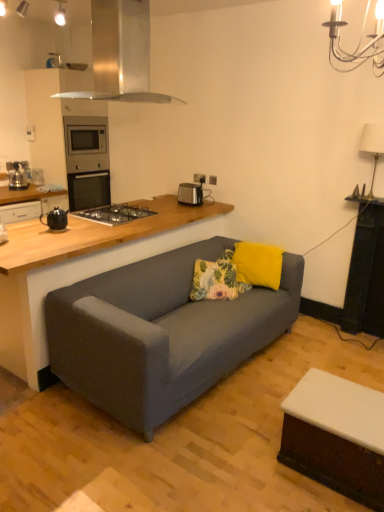
Where is `white glossy coffee table at lower right`? The height and width of the screenshot is (512, 384). white glossy coffee table at lower right is located at coordinates (336, 436).

You are a GUI agent. You are given a task and a screenshot of the screen. Output one action in this format:
    pyautogui.click(x=<x>, y=<y>)
    Task: Click on the black ceramic teapot at left, positioned as the 1th appliance in bottom-to-top order
    This screenshot has width=384, height=512.
    Given the screenshot: What is the action you would take?
    pyautogui.click(x=55, y=219)

In order to face wooden countertop at lower left, should I rotate leftwards or rightwards?

Rotate left and turn 10.103 degrees.

This screenshot has width=384, height=512. Find the location of `white glossy coffee table at lower right`. white glossy coffee table at lower right is located at coordinates (336, 436).

Who is shorter, floral fabric pillow at center, the 2th pillow from the right, or black matte gas stove at center?

black matte gas stove at center is shorter.

Does point (229, 279) come in front of point (119, 208)?

Yes, it is in front of point (119, 208).

From the picture: Is floral fabric pillow at center, the 2th pillow from the right, bigger or smaller than black matte gas stove at center?

In the image, floral fabric pillow at center, the 2th pillow from the right, appears to be larger than black matte gas stove at center.

Is floral fabric pillow at center, the first pillow from the left, closer to the viewer compared to black matte gas stove at center?

Yes.

Is yellow fabric pillow at upper right, the 2th pillow from the left, bigger than white glossy coffee table at lower right?

Incorrect, yellow fabric pillow at upper right, the 2th pillow from the left, is not larger than white glossy coffee table at lower right.

Are yellow fabric pillow at upper right, positioned as the first pillow in right-to-left order, and white glossy coffee table at lower right located far from each other?

Absolutely, yellow fabric pillow at upper right, positioned as the first pillow in right-to-left order, is distant from white glossy coffee table at lower right.

Is yellow fabric pillow at upper right, positioned as the first pillow in right-to-left order, to the right of white glossy coffee table at lower right from the viewer's perspective?

In fact, yellow fabric pillow at upper right, positioned as the first pillow in right-to-left order, is to the left of white glossy coffee table at lower right.

Where is `table that is under the yellow fabric pillow at upper right, the 2th pillow from the left (from a real-world perspective)`? This screenshot has height=512, width=384. table that is under the yellow fabric pillow at upper right, the 2th pillow from the left (from a real-world perspective) is located at coordinates (336, 436).

Are black ceramic teapot at left, which is counted as the 2th appliance, starting from the top, and black matte gas stove at center located far from each other?

No, there isn't a large distance between black ceramic teapot at left, which is counted as the 2th appliance, starting from the top, and black matte gas stove at center.

Is black ceramic teapot at left, the second appliance in the right-to-left sequence, facing towards black matte gas stove at center?

No.

Does point (51, 211) come closer to viewer compared to point (106, 209)?

Yes, it is.

Considering the sizes of white ceramic lamp at upper right and matte black toaster at upper center in the image, is white ceramic lamp at upper right wider or thinner than matte black toaster at upper center?

Clearly, white ceramic lamp at upper right has more width compared to matte black toaster at upper center.

Considering the positions of points (378, 154) and (194, 179), is point (378, 154) closer to camera compared to point (194, 179)?

That is True.

Could you tell me if white ceramic lamp at upper right is facing matte black toaster at upper center?

No, white ceramic lamp at upper right does not turn towards matte black toaster at upper center.

Considering the positions of objects white ceramic lamp at upper right and matte black toaster at upper center in the image provided, who is more to the left, white ceramic lamp at upper right or matte black toaster at upper center?

matte black toaster at upper center.

Is white ceramic lamp at upper right at the left side of black plastic toaster at upper center, the 1th appliance from the top?

Incorrect, white ceramic lamp at upper right is not on the left side of black plastic toaster at upper center, the 1th appliance from the top.

From a real-world perspective, which object stands above the other?

white ceramic lamp at upper right.

Considering their positions, is white ceramic lamp at upper right located in front of or behind black plastic toaster at upper center, the 1th appliance from the top?

Clearly, white ceramic lamp at upper right is in front of black plastic toaster at upper center, the 1th appliance from the top.

Considering the relative sizes of white ceramic lamp at upper right and black plastic toaster at upper center, the first appliance viewed from the right, in the image provided, is white ceramic lamp at upper right thinner than black plastic toaster at upper center, the first appliance viewed from the right,?

No.

Where is `the 2nd appliance positioned below the white ceramic lamp at upper right (from the image's perspective)`? This screenshot has height=512, width=384. the 2nd appliance positioned below the white ceramic lamp at upper right (from the image's perspective) is located at coordinates (55, 219).

Considering the relative sizes of white ceramic lamp at upper right and black ceramic teapot at left, the second appliance in the right-to-left sequence, in the image provided, is white ceramic lamp at upper right bigger than black ceramic teapot at left, the second appliance in the right-to-left sequence,?

Yes.

From the image's perspective, between white ceramic lamp at upper right and black ceramic teapot at left, which is the second appliance from back to front, which one is located above?

From the image's view, white ceramic lamp at upper right is above.

Does white ceramic lamp at upper right have a greater width compared to black ceramic teapot at left, which is counted as the 2th appliance, starting from the top?

Indeed, white ceramic lamp at upper right has a greater width compared to black ceramic teapot at left, which is counted as the 2th appliance, starting from the top.

Is point (66, 225) positioned after point (233, 253)?

No, (66, 225) is closer to viewer.

Who is taller, black ceramic teapot at left, the second appliance in the right-to-left sequence, or floral fabric pillow at center, the 2th pillow from the right?

floral fabric pillow at center, the 2th pillow from the right.

Is black ceramic teapot at left, the second appliance in the right-to-left sequence, next to floral fabric pillow at center, the first pillow from the left, and touching it?

No, black ceramic teapot at left, the second appliance in the right-to-left sequence, is not next to floral fabric pillow at center, the first pillow from the left.

From a real-world perspective, between black ceramic teapot at left, the second appliance in the right-to-left sequence, and floral fabric pillow at center, the first pillow from the left, who is vertically lower?

floral fabric pillow at center, the first pillow from the left, is physically lower.

The height and width of the screenshot is (512, 384). What are the coordinates of `gas stove behind the floral fabric pillow at center, the 2th pillow from the right` in the screenshot? It's located at (115, 214).

Identify the location of the 2nd pillow located above the white glossy coffee table at lower right (from a real-world perspective). (258, 264).

Considering their positions, is stainless steel range hood at upper center positioned closer to black plastic toaster at upper center, the first appliance viewed from the right, than floral fabric pillow at center, the first pillow from the left?

floral fabric pillow at center, the first pillow from the left, is positioned closer to the anchor black plastic toaster at upper center, the first appliance viewed from the right.

When comparing their distances from black matte gas stove at center, does white ceramic lamp at upper right or black ceramic teapot at left, which is the second appliance from back to front, seem closer?

black ceramic teapot at left, which is the second appliance from back to front, lies closer to black matte gas stove at center than the other object.

Looking at the image, which one is located further to black matte gas stove at center, stainless steel range hood at upper center or white ceramic lamp at upper right?

The object further to black matte gas stove at center is white ceramic lamp at upper right.

When comparing their distances from stainless steel range hood at upper center, does matte black toaster at upper center or white ceramic lamp at upper right seem closer?

Among the two, matte black toaster at upper center is located nearer to stainless steel range hood at upper center.

Estimate the real-world distances between objects in this image. Which object is closer to wooden countertop at lower left, floral fabric pillow at center, the first pillow from the left, or stainless steel range hood at upper center?

floral fabric pillow at center, the first pillow from the left, is positioned closer to the anchor wooden countertop at lower left.

Which object lies nearer to the anchor point black plastic toaster at upper center, the 1th appliance from the top, white ceramic lamp at upper right or matte black toaster at upper center?

matte black toaster at upper center is positioned closer to the anchor black plastic toaster at upper center, the 1th appliance from the top.

From the image, which object appears to be farther from white glossy coffee table at lower right, wooden countertop at lower left or black matte gas stove at center?

The object further to white glossy coffee table at lower right is black matte gas stove at center.

Estimate the real-world distances between objects in this image. Which object is closer to wooden countertop at lower left, white glossy coffee table at lower right or white ceramic lamp at upper right?

white glossy coffee table at lower right.

The width and height of the screenshot is (384, 512). I want to click on gas stove situated between black ceramic teapot at left, which is counted as the 2th appliance, starting from the top, and white glossy coffee table at lower right from left to right, so click(x=115, y=214).

This screenshot has height=512, width=384. Identify the location of gas stove positioned between white glossy coffee table at lower right and black plastic toaster at upper center, arranged as the first appliance when viewed from the back, from near to far. (115, 214).

Find the location of `appliance located between black matte gas stove at center and white ceramic lamp at upper right in the left-right direction`. appliance located between black matte gas stove at center and white ceramic lamp at upper right in the left-right direction is located at coordinates (190, 194).

The width and height of the screenshot is (384, 512). In order to click on countertop positioned between white glossy coffee table at lower right and matte black toaster at upper center from near to far in this screenshot , I will do `click(81, 267)`.